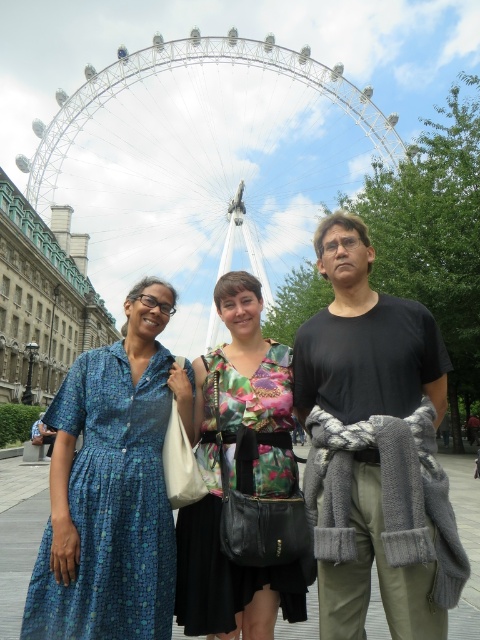
From the picture: You are a photographer planning to take a group photo of the three people in front of the London Eye. Given that the white metal ferris wheel at upper center and the floral fabric dress at center are both visible in the frame, which object occupies more horizontal space in the photo?

The white metal ferris wheel at upper center occupies more horizontal space in the photo because its width is larger than that of the floral fabric dress at center.

From the picture: You are a photographer standing in front of the London Eye and want to take a photo of the three people. The white metal ferris wheel at upper center is located at coordinates 0.252, 0.427. If you want to include the ferris wheel in the background, where should you position the camera relative to the people?

To include the white metal ferris wheel at upper center in the background, position the camera so that the people are placed towards the lower part of the frame, allowing the ferris wheel at coordinates (204, 161) to be visible above them.